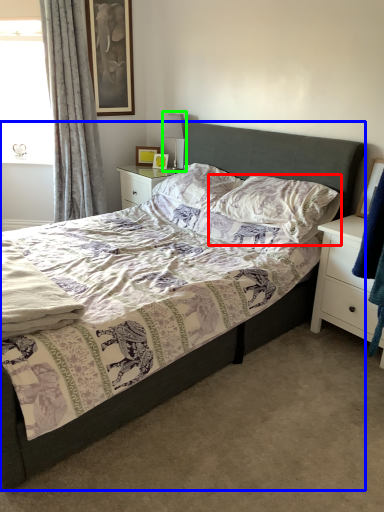
Question: Which object is positioned farthest from pillow (highlighted by a red box)? Select from bed (highlighted by a blue box) and table lamp (highlighted by a green box).

Choices:
 (A) bed
 (B) table lamp

Answer: (B)